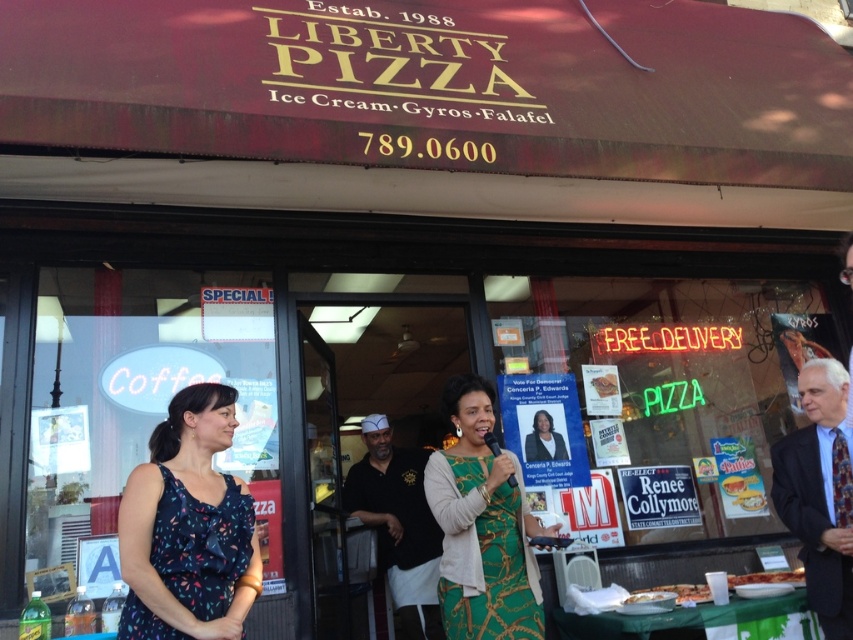
Measure the distance between black shirt at center and white paper plate at lower center.

black shirt at center is 4.58 feet from white paper plate at lower center.

Between black shirt at center and white paper plate at lower center, which one is positioned lower?

black shirt at center is below.

Between point (425, 564) and point (646, 596), which one is positioned behind?

Point (425, 564)

Locate an element on the screen. Image resolution: width=853 pixels, height=640 pixels. black shirt at center is located at coordinates (398, 524).

Can you confirm if black shirt at center is wider than golden crispy pizza at center?

No, black shirt at center is not wider than golden crispy pizza at center.

Does point (402, 602) come in front of point (733, 577)?

No.

You are a GUI agent. You are given a task and a screenshot of the screen. Output one action in this format:
    pyautogui.click(x=<x>, y=<y>)
    Task: Click on the black shirt at center
    This screenshot has height=640, width=853.
    Given the screenshot: What is the action you would take?
    pyautogui.click(x=398, y=524)

Between dark suit at right and golden crispy pizza at center, which one appears on the left side from the viewer's perspective?

dark suit at right

Which of these two, dark suit at right or golden crispy pizza at center, stands taller?

Standing taller between the two is dark suit at right.

Who is more forward, (845, 612) or (735, 580)?

Point (845, 612)

Where is `dark suit at right`? The height and width of the screenshot is (640, 853). dark suit at right is located at coordinates [819, 493].